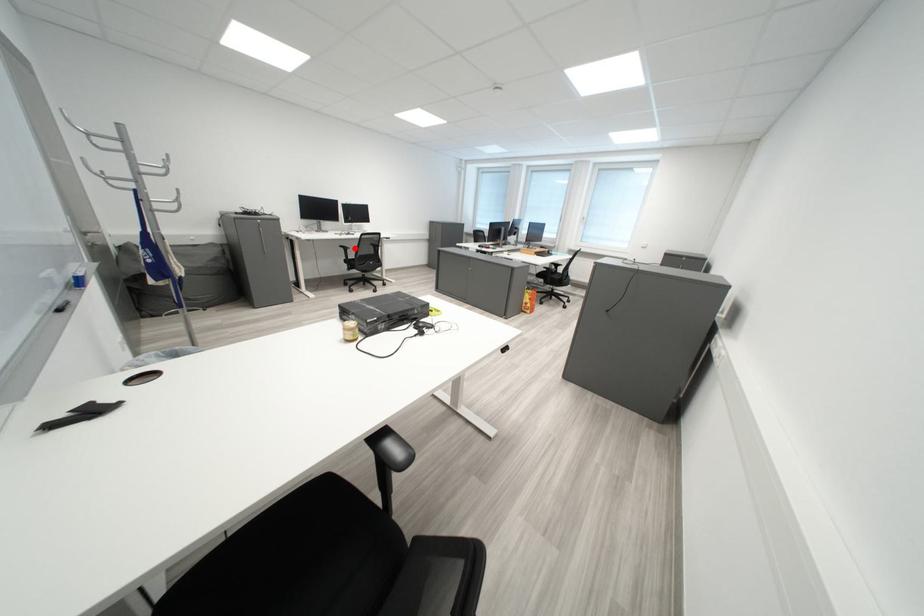
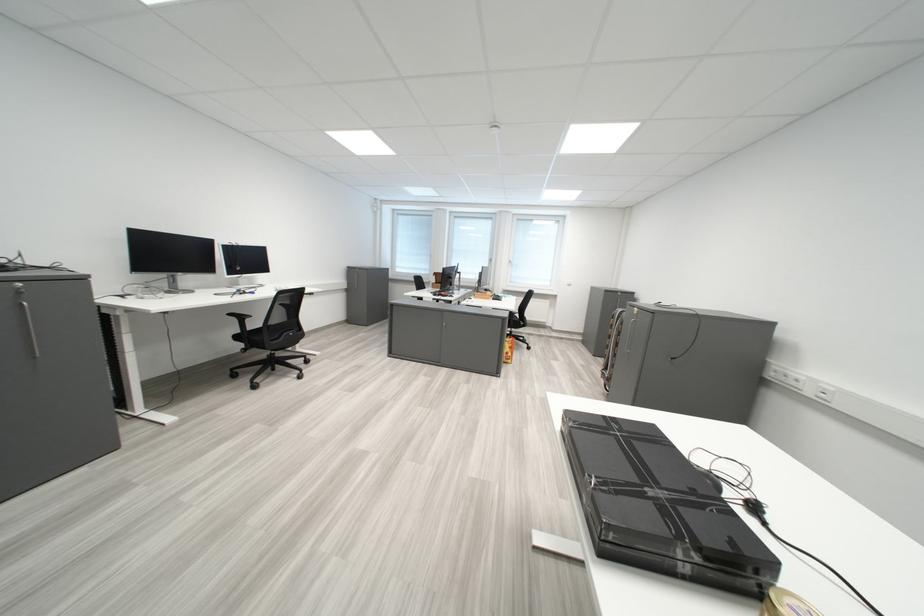
Find the pixel in the second image that matches the highlighted location in the first image.

(244, 317)